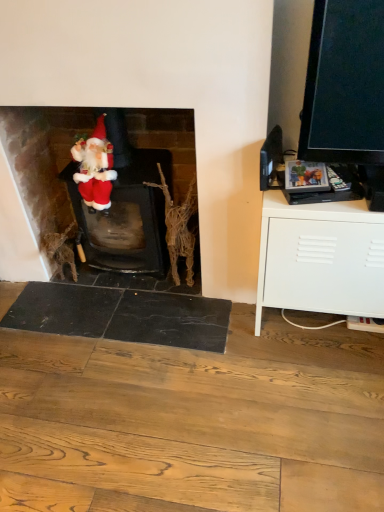
In order to face velvet red santa at center, should I rotate leftwards or rightwards?

Turn left approximately 9.952 degrees to face it.

The width and height of the screenshot is (384, 512). Find the location of `white matte cabinet at right`. white matte cabinet at right is located at coordinates (320, 258).

What do you see at coordinates (320, 258) in the screenshot? I see `white matte cabinet at right` at bounding box center [320, 258].

This screenshot has height=512, width=384. In order to click on velvet red santa at center in this screenshot , I will do `click(42, 159)`.

Considering the positions of objects velvet red santa at center and matte red santa at left in the image provided, who is in front, velvet red santa at center or matte red santa at left?

velvet red santa at center is closer to the camera.

This screenshot has height=512, width=384. What are the coordinates of `fireplace beneath the matte red santa at left (from a real-world perspective)` in the screenshot? It's located at (42, 159).

From the image's perspective, is velvet red santa at center above or below matte red santa at left?

From the image's perspective, velvet red santa at center appears below matte red santa at left.

Would you say velvet red santa at center is to the left or to the right of matte red santa at left in the picture?

velvet red santa at center is positioned on matte red santa at left's right side.

Find the location of a particular element. This screenshot has height=512, width=384. person that is above the white matte cabinet at right (from a real-world perspective) is located at coordinates (95, 168).

Relative to matte red santa at left, is white matte cabinet at right in front or behind?

In the image, white matte cabinet at right appears in front of matte red santa at left.

In the scene shown: Can you tell me how much white matte cabinet at right and matte red santa at left differ in facing direction?

1.18 degrees separate the facing orientations of white matte cabinet at right and matte red santa at left.

Would you say velvet red santa at center is a long distance from bark-like textured branch at center?

No, velvet red santa at center is not far from bark-like textured branch at center.

Considering the positions of objects velvet red santa at center and bark-like textured branch at center in the image provided, who is in front, velvet red santa at center or bark-like textured branch at center?

velvet red santa at center is in front.

From a real-world perspective, which is physically below, velvet red santa at center or bark-like textured branch at center?

In real-world perspective, bark-like textured branch at center is lower.

From the image's perspective, relative to bark-like textured branch at center, is velvet red santa at center above or below?

From the image's perspective, velvet red santa at center appears above bark-like textured branch at center.

Considering the relative sizes of bark-like textured branch at center and white matte cabinet at right in the image provided, is bark-like textured branch at center taller than white matte cabinet at right?

In fact, bark-like textured branch at center may be shorter than white matte cabinet at right.

From the image's perspective, is bark-like textured branch at center below white matte cabinet at right?

No, from the image's perspective, bark-like textured branch at center is not beneath white matte cabinet at right.

Locate an element on the screen. The image size is (384, 512). cabinetry located on the right of bark-like textured branch at center is located at coordinates (320, 258).

Consider the image. Is bark-like textured branch at center wider or thinner than matte red santa at left?

Considering their sizes, bark-like textured branch at center looks broader than matte red santa at left.

Considering the sizes of objects bark-like textured branch at center and matte red santa at left in the image provided, who is bigger, bark-like textured branch at center or matte red santa at left?

With larger size is bark-like textured branch at center.

From a real-world perspective, is bark-like textured branch at center physically located above or below matte red santa at left?

bark-like textured branch at center is below matte red santa at left.

Is bark-like textured branch at center spatially inside matte red santa at left, or outside of it?

bark-like textured branch at center exists outside the volume of matte red santa at left.

Would you say white matte cabinet at right is a long distance from bark-like textured branch at center?

No.

Can you confirm if white matte cabinet at right is positioned to the left of bark-like textured branch at center?

Incorrect, white matte cabinet at right is not on the left side of bark-like textured branch at center.

Where is `branch located behind the white matte cabinet at right`? The width and height of the screenshot is (384, 512). branch located behind the white matte cabinet at right is located at coordinates (179, 227).

Is point (360, 205) less distant than point (190, 272)?

Yes, it is.

From the image's perspective, is white matte cabinet at right on top of velvet red santa at center?

No, from the image's perspective, white matte cabinet at right is not on top of velvet red santa at center.

Considering the sizes of objects white matte cabinet at right and velvet red santa at center in the image provided, who is shorter, white matte cabinet at right or velvet red santa at center?

white matte cabinet at right is shorter.

Which object is further away from the camera, white matte cabinet at right or velvet red santa at center?

velvet red santa at center is further from the camera.

Locate an element on the screen. person on the left side of velvet red santa at center is located at coordinates (95, 168).

You are a GUI agent. You are given a task and a screenshot of the screen. Output one action in this format:
    pyautogui.click(x=<x>, y=<y>)
    Task: Click on the cabinetry on the right of matte red santa at left
    
    Given the screenshot: What is the action you would take?
    pyautogui.click(x=320, y=258)

Which object lies further to the anchor point bark-like textured branch at center, matte red santa at left or white matte cabinet at right?

white matte cabinet at right is positioned further to the anchor bark-like textured branch at center.

Based on their spatial positions, is matte red santa at left or white matte cabinet at right further from velvet red santa at center?

white matte cabinet at right is positioned further to the anchor velvet red santa at center.

When comparing their distances from bark-like textured branch at center, does white matte cabinet at right or velvet red santa at center seem closer?

The object closer to bark-like textured branch at center is velvet red santa at center.

When comparing their distances from velvet red santa at center, does bark-like textured branch at center or matte red santa at left seem further?

The object further to velvet red santa at center is bark-like textured branch at center.

Looking at this image, considering their positions, is velvet red santa at center positioned further to bark-like textured branch at center than matte red santa at left?

Among the two, velvet red santa at center is located further to bark-like textured branch at center.

From the image, which object appears to be farther from velvet red santa at center, matte red santa at left or bark-like textured branch at center?

Based on the image, bark-like textured branch at center appears to be further to velvet red santa at center.

Looking at the image, which one is located further to velvet red santa at center, bark-like textured branch at center or white matte cabinet at right?

Among the two, white matte cabinet at right is located further to velvet red santa at center.

Based on their spatial positions, is velvet red santa at center or bark-like textured branch at center further from white matte cabinet at right?

Based on the image, velvet red santa at center appears to be further to white matte cabinet at right.

The width and height of the screenshot is (384, 512). In order to click on fireplace between matte red santa at left and bark-like textured branch at center from left to right in this screenshot , I will do `click(42, 159)`.

Find the location of `fireplace between matte red santa at left and white matte cabinet at right in the horizontal direction`. fireplace between matte red santa at left and white matte cabinet at right in the horizontal direction is located at coordinates (42, 159).

Where is `branch between matte red santa at left and white matte cabinet at right`? The image size is (384, 512). branch between matte red santa at left and white matte cabinet at right is located at coordinates (179, 227).

Locate an element on the screen. The image size is (384, 512). branch between velvet red santa at center and white matte cabinet at right from left to right is located at coordinates (179, 227).